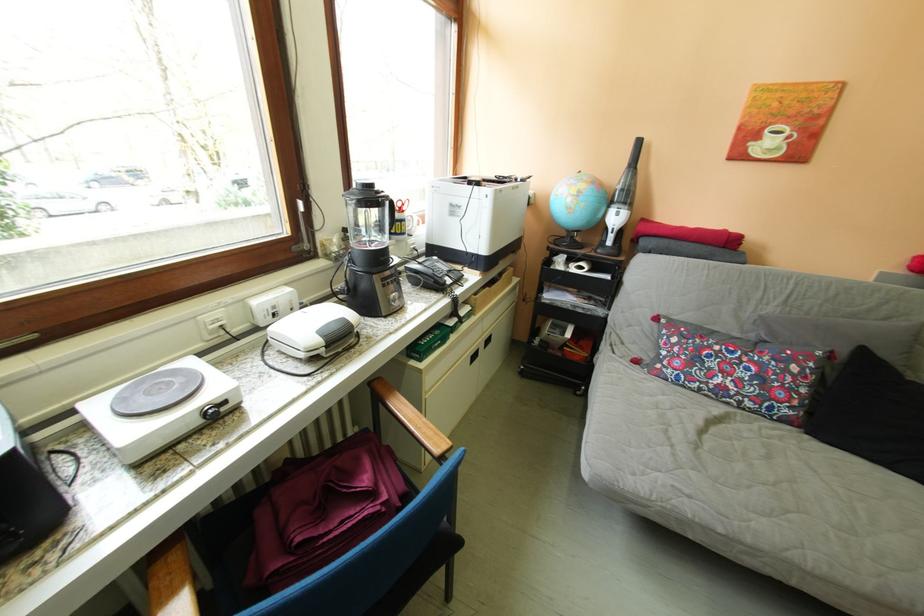
The height and width of the screenshot is (616, 924). Identify the location of wooden chair armrest. (407, 418).